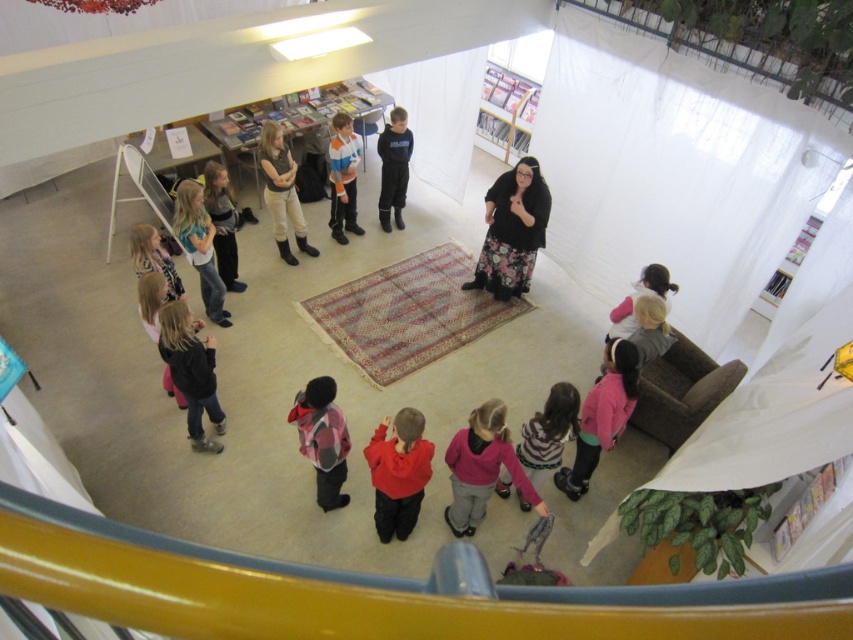
Question: Which of the following is the farthest from the observer?

Choices:
 (A) (224, 209)
 (B) (645, 358)
 (C) (283, 257)
 (D) (305, 452)

Answer: (C)

Question: Does carpeted rug at center have a smaller size compared to black matte pants at center?

Choices:
 (A) yes
 (B) no

Answer: (B)

Question: Can you confirm if dark gray fleece jacket at lower left is positioned above matte black boots at center?

Choices:
 (A) yes
 (B) no

Answer: (B)

Question: Which object is the farthest from the matte black boots at center?

Choices:
 (A) carpeted rug at center
 (B) matte blue jacket at lower left
 (C) pink fleece jacket at lower center
 (D) dark gray fleece jacket at lower left

Answer: (C)

Question: Which point appears closest to the camera in this image?

Choices:
 (A) (200, 376)
 (B) (601, 408)
 (C) (561, 401)
 (D) (387, 195)

Answer: (C)

Question: Is striped sweater at lower center to the right of light pink sweater at upper right from the viewer's perspective?

Choices:
 (A) yes
 (B) no

Answer: (B)